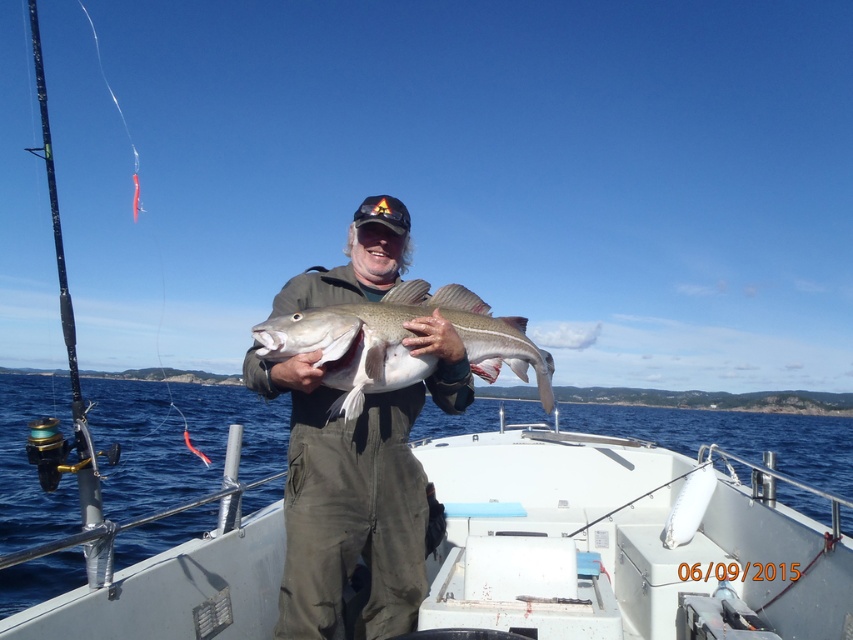
Is white plastic boat at center further to the viewer compared to silver metallic fish at center?

That is True.

Which is above, white plastic boat at center or silver metallic fish at center?

silver metallic fish at center

This screenshot has height=640, width=853. Identify the location of white plastic boat at center. (178, 438).

Does white plastic boat at center have a lesser width compared to dark green corduroy overalls at center?

In fact, white plastic boat at center might be wider than dark green corduroy overalls at center.

Between point (154, 440) and point (422, 387), which one is positioned in front?

Positioned in front is point (422, 387).

I want to click on white plastic boat at center, so click(178, 438).

Measure the distance between dark green corduroy overalls at center and camera.

They are 8.50 feet apart.

This screenshot has width=853, height=640. Find the location of `dark green corduroy overalls at center`. dark green corduroy overalls at center is located at coordinates (357, 490).

Find the location of a particular element. Image resolution: width=853 pixels, height=640 pixels. dark green corduroy overalls at center is located at coordinates (357, 490).